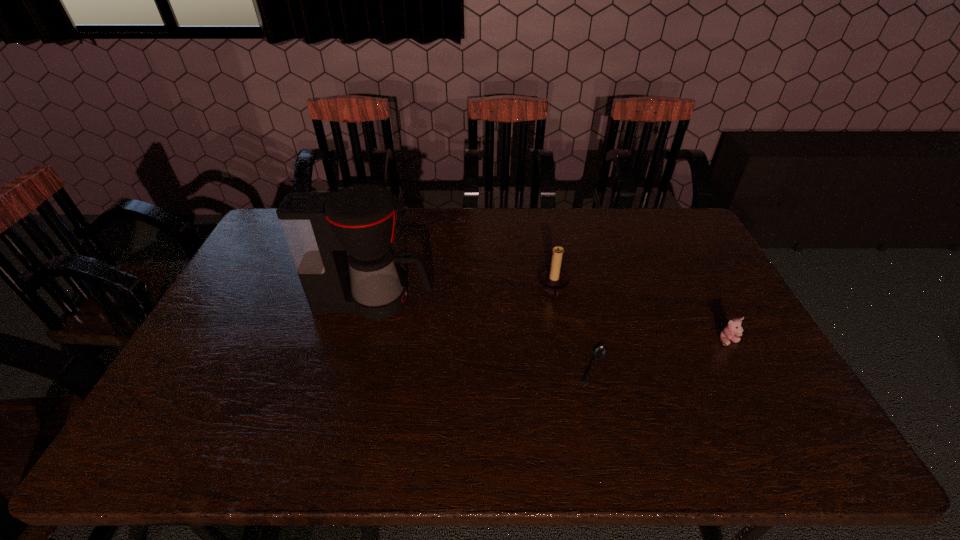
Find the location of a particular element. The width and height of the screenshot is (960, 540). coffee maker is located at coordinates (319, 227).

Locate an element on the screen. the tallest object is located at coordinates (319, 227).

This screenshot has height=540, width=960. Identify the location of candle holder. (553, 281).

This screenshot has width=960, height=540. In order to click on the rightmost object in this screenshot , I will do `click(733, 330)`.

What are the coordinates of `teddy bear` in the screenshot? It's located at (733, 330).

Identify the location of soupspoon. This screenshot has height=540, width=960. click(599, 352).

Identify the location of the nearest object. This screenshot has height=540, width=960. (599, 352).

At what (x,y) coordinates should I click in order to perform the action: click on free region located pour from the carafe of the tallest object. Please return your answer as a coordinate pair (x, y). The height and width of the screenshot is (540, 960). Looking at the image, I should click on (467, 301).

Locate an element on the screen. free space located 0.210m on the wick of the candle holder is located at coordinates (472, 289).

Locate an element on the screen. free space located 0.370m on the wick of the candle holder is located at coordinates (421, 289).